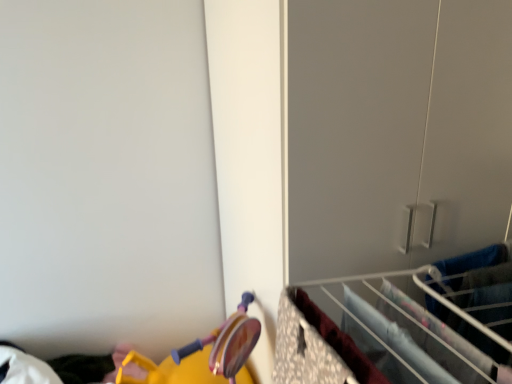
Question: Considering the positions of point (289, 294) and point (307, 362), is point (289, 294) closer or farther from the camera than point (307, 362)?

Choices:
 (A) closer
 (B) farther

Answer: (B)

Question: In terms of height, does metal wire rack at lower right, the 2th closet from the right, look taller or shorter compared to floral fabric drawer at lower right?

Choices:
 (A) tall
 (B) short

Answer: (B)

Question: Based on their relative distances, which object is farther from the floral fabric drawer at lower right?

Choices:
 (A) matte gray closet at center-right, the second closet from the left
 (B) metal wire rack at lower right, the first closet when ordered from left to right

Answer: (A)

Question: Estimate the real-world distances between objects in this image. Which object is farther from the metal wire rack at lower right, marked as the second closet in a top-to-bottom arrangement?

Choices:
 (A) matte gray closet at center-right, acting as the 2th closet starting from the bottom
 (B) floral fabric drawer at lower right

Answer: (A)